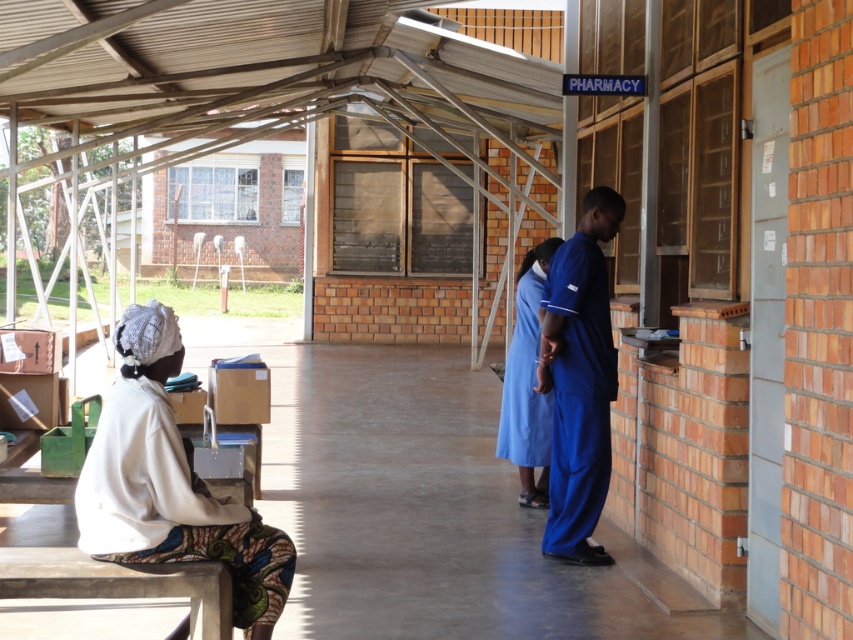
Question: Is blue fabric pants at right wider than blue fabric dress at center?

Choices:
 (A) no
 (B) yes

Answer: (B)

Question: Can you confirm if blue fabric pants at right is positioned to the right of blue fabric dress at center?

Choices:
 (A) yes
 (B) no

Answer: (A)

Question: Which point is farther to the camera?

Choices:
 (A) (518, 502)
 (B) (224, 548)
 (C) (602, 314)

Answer: (A)

Question: Which of these objects is positioned closest to the blue fabric pants at right?

Choices:
 (A) white fabric at left
 (B) blue fabric dress at center

Answer: (B)

Question: Which point appears closest to the camera in this image?

Choices:
 (A) (173, 340)
 (B) (590, 552)

Answer: (A)

Question: Can you confirm if blue fabric pants at right is positioned below blue fabric dress at center?

Choices:
 (A) yes
 (B) no

Answer: (B)